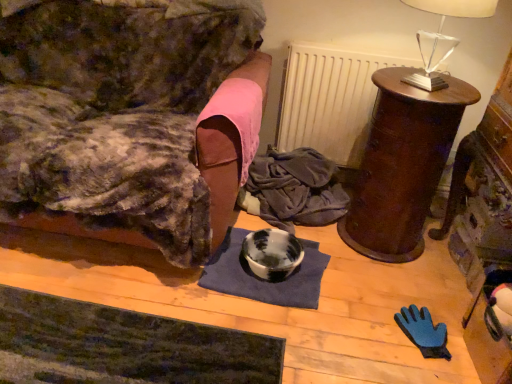
This screenshot has width=512, height=384. In order to click on vacant area that lies between mahogany wood side table at right, which is the 2th furniture from left to right, and blue fabric mat at center in this screenshot , I will do `click(343, 264)`.